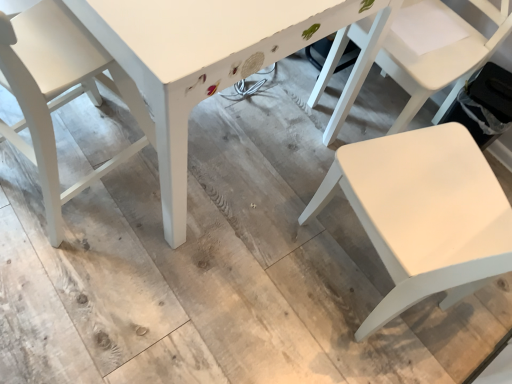
This screenshot has width=512, height=384. I want to click on vacant region below white matte chair at lower right, the 2th chair viewed from the right (from a real-world perspective), so click(366, 275).